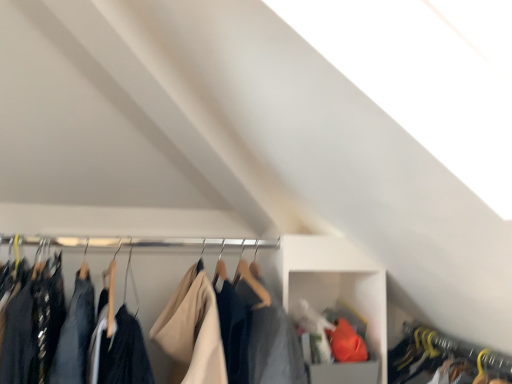
What is the approximate width of white plastic cabinet at center?

The width of white plastic cabinet at center is 43.55 centimeters.

Measure the distance between point [317,265] and camera.

The distance of point [317,265] from camera is 4.82 feet.

Identify the location of yellow hanger at lower right, which is the first closet from right to left. (459, 350).

Can you see dark blue fabric at center, the second closet when ordered from right to left, touching white plastic cabinet at center?

No, dark blue fabric at center, the second closet when ordered from right to left, is not in contact with white plastic cabinet at center.

From a real-world perspective, which is physically below, dark blue fabric at center, the second closet when ordered from right to left, or white plastic cabinet at center?

white plastic cabinet at center is physically lower.

Between dark blue fabric at center, placed as the first closet when sorted from left to right, and white plastic cabinet at center, which one appears on the left side from the viewer's perspective?

Positioned to the left is dark blue fabric at center, placed as the first closet when sorted from left to right.

Is dark blue fabric at center, placed as the first closet when sorted from left to right, facing away from white plastic cabinet at center?

No, dark blue fabric at center, placed as the first closet when sorted from left to right, is not facing away from white plastic cabinet at center.

Does white plastic cabinet at center have a larger size compared to dark blue fabric at center, placed as the first closet when sorted from left to right?

No.

Looking at this image, is white plastic cabinet at center oriented towards dark blue fabric at center, the second closet when ordered from right to left?

No, white plastic cabinet at center is not aimed at dark blue fabric at center, the second closet when ordered from right to left.

This screenshot has height=384, width=512. I want to click on cabinet behind the dark blue fabric at center, the second closet when ordered from right to left, so click(336, 284).

From a real-world perspective, does white plastic cabinet at center sit lower than dark blue fabric at center, the second closet when ordered from right to left?

Yes, from a real-world perspective, white plastic cabinet at center is below dark blue fabric at center, the second closet when ordered from right to left.

Is dark blue fabric at center, the second closet when ordered from right to left, aimed at yellow hanger at lower right, which is the 2th closet from left to right?

No, dark blue fabric at center, the second closet when ordered from right to left, is not oriented towards yellow hanger at lower right, which is the 2th closet from left to right.

Who is smaller, dark blue fabric at center, placed as the first closet when sorted from left to right, or yellow hanger at lower right, which is the 2th closet from left to right?

Smaller between the two is yellow hanger at lower right, which is the 2th closet from left to right.

Considering their positions, is dark blue fabric at center, the second closet when ordered from right to left, located in front of or behind yellow hanger at lower right, which is the 2th closet from left to right?

In the image, dark blue fabric at center, the second closet when ordered from right to left, appears in front of yellow hanger at lower right, which is the 2th closet from left to right.

How different are the orientations of yellow hanger at lower right, which is the 2th closet from left to right, and dark blue fabric at center, the second closet when ordered from right to left, in degrees?

92 degrees.

Relative to dark blue fabric at center, the second closet when ordered from right to left, is yellow hanger at lower right, which is the 2th closet from left to right, in front or behind?

In the image, yellow hanger at lower right, which is the 2th closet from left to right, appears behind dark blue fabric at center, the second closet when ordered from right to left.

Is yellow hanger at lower right, which is the 2th closet from left to right, inside the boundaries of dark blue fabric at center, the second closet when ordered from right to left, or outside?

yellow hanger at lower right, which is the 2th closet from left to right, is outside dark blue fabric at center, the second closet when ordered from right to left.

Between yellow hanger at lower right, which is the first closet from right to left, and dark blue fabric at center, the second closet when ordered from right to left, which one has smaller width?

dark blue fabric at center, the second closet when ordered from right to left.

Is point (396, 363) closer to camera compared to point (340, 247)?

No, (396, 363) is behind (340, 247).

Is yellow hanger at lower right, which is the 2th closet from left to right, thinner than white plastic cabinet at center?

No, yellow hanger at lower right, which is the 2th closet from left to right, is not thinner than white plastic cabinet at center.

Can you tell me how much yellow hanger at lower right, which is the 2th closet from left to right, and white plastic cabinet at center differ in facing direction?

yellow hanger at lower right, which is the 2th closet from left to right, and white plastic cabinet at center are facing 92.2 degrees away from each other.

Is yellow hanger at lower right, which is the 2th closet from left to right, not close to white plastic cabinet at center?

No, yellow hanger at lower right, which is the 2th closet from left to right, is not far from white plastic cabinet at center.

From the image's perspective, between white plastic cabinet at center and yellow hanger at lower right, which is the 2th closet from left to right, which one is located above?

white plastic cabinet at center appears higher in the image.

From a real-world perspective, which is physically above, white plastic cabinet at center or yellow hanger at lower right, which is the first closet from right to left?

white plastic cabinet at center.

Considering the sizes of objects white plastic cabinet at center and yellow hanger at lower right, which is the 2th closet from left to right, in the image provided, who is thinner, white plastic cabinet at center or yellow hanger at lower right, which is the 2th closet from left to right,?

white plastic cabinet at center.

Can you see white plastic cabinet at center touching yellow hanger at lower right, which is the first closet from right to left?

No, white plastic cabinet at center is not touching yellow hanger at lower right, which is the first closet from right to left.

Where is `closet above the white plastic cabinet at center (from the image's perspective)`? This screenshot has height=384, width=512. closet above the white plastic cabinet at center (from the image's perspective) is located at coordinates (193, 329).

Where is `closet that appears on the left of white plastic cabinet at center`? The width and height of the screenshot is (512, 384). closet that appears on the left of white plastic cabinet at center is located at coordinates (193, 329).

Which object lies nearer to the anchor point white plastic cabinet at center, dark blue fabric at center, placed as the first closet when sorted from left to right, or yellow hanger at lower right, which is the first closet from right to left?

The object closer to white plastic cabinet at center is dark blue fabric at center, placed as the first closet when sorted from left to right.

From the picture: From the image, which object appears to be farther from white plastic cabinet at center, yellow hanger at lower right, which is the first closet from right to left, or dark blue fabric at center, placed as the first closet when sorted from left to right?

yellow hanger at lower right, which is the first closet from right to left.

From the image, which object appears to be nearer to dark blue fabric at center, placed as the first closet when sorted from left to right, white plastic cabinet at center or yellow hanger at lower right, which is the first closet from right to left?

Based on the image, white plastic cabinet at center appears to be nearer to dark blue fabric at center, placed as the first closet when sorted from left to right.

Based on the photo, when comparing their distances from dark blue fabric at center, the second closet when ordered from right to left, does yellow hanger at lower right, which is the 2th closet from left to right, or white plastic cabinet at center seem further?

yellow hanger at lower right, which is the 2th closet from left to right, lies further to dark blue fabric at center, the second closet when ordered from right to left, than the other object.

Considering their positions, is dark blue fabric at center, the second closet when ordered from right to left, positioned closer to yellow hanger at lower right, which is the 2th closet from left to right, than white plastic cabinet at center?

Among the two, white plastic cabinet at center is located nearer to yellow hanger at lower right, which is the 2th closet from left to right.

Which object lies nearer to the anchor point yellow hanger at lower right, which is the 2th closet from left to right, white plastic cabinet at center or dark blue fabric at center, the second closet when ordered from right to left?

Based on the image, white plastic cabinet at center appears to be nearer to yellow hanger at lower right, which is the 2th closet from left to right.

Where is `cabinet between dark blue fabric at center, the second closet when ordered from right to left, and yellow hanger at lower right, which is the 2th closet from left to right`? This screenshot has height=384, width=512. cabinet between dark blue fabric at center, the second closet when ordered from right to left, and yellow hanger at lower right, which is the 2th closet from left to right is located at coordinates (336, 284).